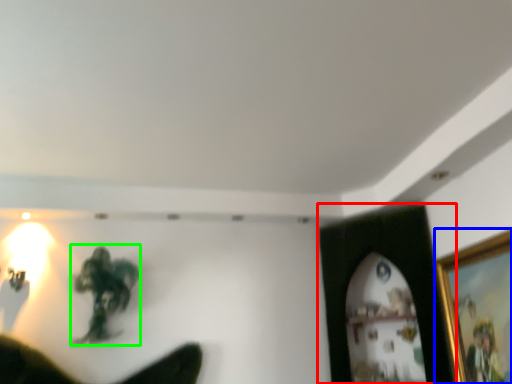
Question: Which object is positioned closest to picture frame (highlighted by a red box)? Select from picture frame (highlighted by a blue box) and person (highlighted by a green box).

Choices:
 (A) picture frame
 (B) person

Answer: (A)